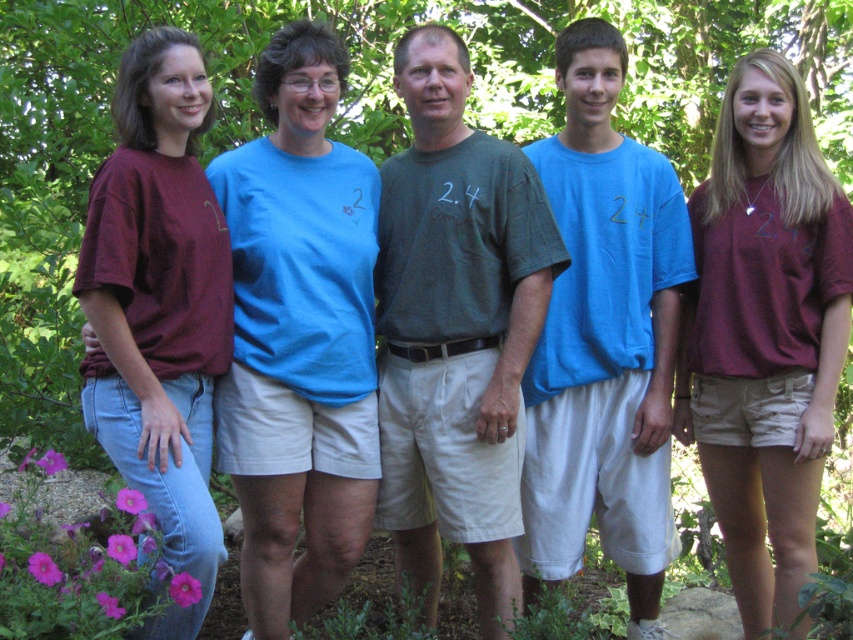
Does blue cotton shirt at center have a smaller size compared to burgundy cotton t-shirt at center?

Correct, blue cotton shirt at center occupies less space than burgundy cotton t-shirt at center.

Is blue cotton shirt at center further to the viewer compared to burgundy cotton t-shirt at center?

Yes.

Where is `blue cotton shirt at center`? The width and height of the screenshot is (853, 640). blue cotton shirt at center is located at coordinates (299, 337).

Can you confirm if dark green t-shirt at center is wider than burgundy cotton t-shirt at center?

Indeed, dark green t-shirt at center has a greater width compared to burgundy cotton t-shirt at center.

Does point (498, 592) come behind point (811, 422)?

Yes.

Find the location of a particular element. This screenshot has width=853, height=640. dark green t-shirt at center is located at coordinates (456, 328).

Which of these two, dark green t-shirt at center or matte burgundy t-shirt at left, stands shorter?

matte burgundy t-shirt at left is shorter.

Can you confirm if dark green t-shirt at center is wider than matte burgundy t-shirt at left?

Correct, the width of dark green t-shirt at center exceeds that of matte burgundy t-shirt at left.

What do you see at coordinates (456, 328) in the screenshot? The height and width of the screenshot is (640, 853). I see `dark green t-shirt at center` at bounding box center [456, 328].

I want to click on dark green t-shirt at center, so coord(456,328).